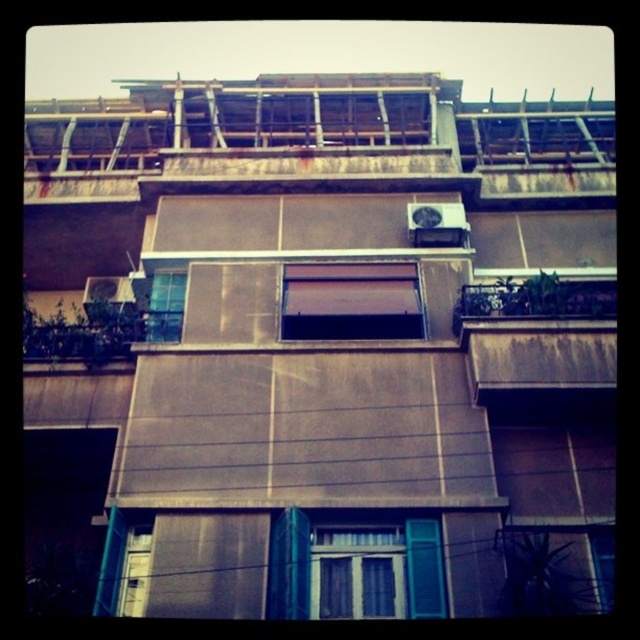
Which of these two, brown matte awning at center or clear glass window at center, stands shorter?

brown matte awning at center is shorter.

Between point (404, 324) and point (180, 298), which one is positioned in front?

Point (404, 324) is more forward.

This screenshot has height=640, width=640. I want to click on brown matte awning at center, so click(349, 301).

Is point (348, 582) positioned behind point (356, 273)?

No, it is in front of (356, 273).

Does wooden shuttered window at center have a greater width compared to brown matte awning at center?

Incorrect, wooden shuttered window at center's width does not surpass brown matte awning at center's.

This screenshot has height=640, width=640. In order to click on wooden shuttered window at center in this screenshot , I will do `click(355, 570)`.

Find the location of a particular element. This screenshot has height=640, width=640. wooden shuttered window at center is located at coordinates (355, 570).

Is wooden shuttered window at center positioned before brown wooden balcony at right?

That is True.

Is wooden shuttered window at center wider than brown wooden balcony at right?

Yes.

Find the location of a particular element. Image resolution: width=640 pixels, height=640 pixels. wooden shuttered window at center is located at coordinates (355, 570).